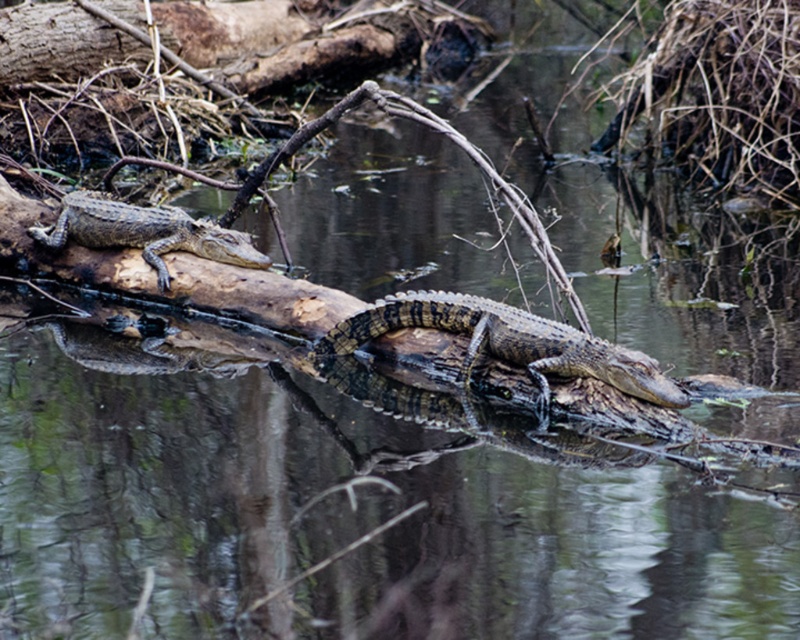
From the picture: You are observing two points in the swamp scene. The first point is at coordinates point (x=394, y=298) and the second is at point (x=93, y=243). Based on their positions, which point is nearer to you?

Point (x=394, y=298) is closer to the viewer than point (x=93, y=243).